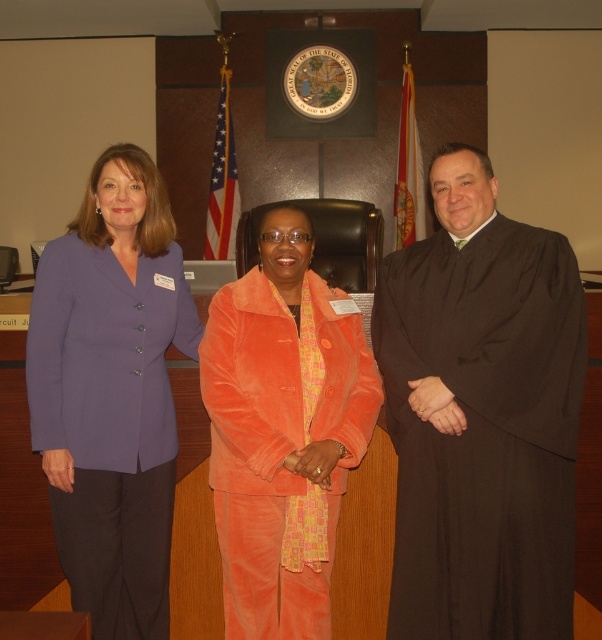
Question: Which of the following is the farthest from the observer?

Choices:
 (A) black matte robe at right
 (B) velvet orange suit at center

Answer: (A)

Question: From the image, what is the correct spatial relationship of matte purple blazer at left in relation to velvet orange suit at center?

Choices:
 (A) above
 (B) below

Answer: (A)

Question: Which of the following is the closest to the observer?

Choices:
 (A) (275, 422)
 (B) (58, 403)

Answer: (B)

Question: Which object appears farthest from the camera in this image?

Choices:
 (A) matte purple blazer at left
 (B) velvet orange suit at center
 (C) black matte robe at right

Answer: (C)

Question: From the image, what is the correct spatial relationship of black matte robe at right in relation to velvet orange suit at center?

Choices:
 (A) above
 (B) below

Answer: (B)

Question: Does black matte robe at right have a smaller size compared to matte purple blazer at left?

Choices:
 (A) yes
 (B) no

Answer: (A)